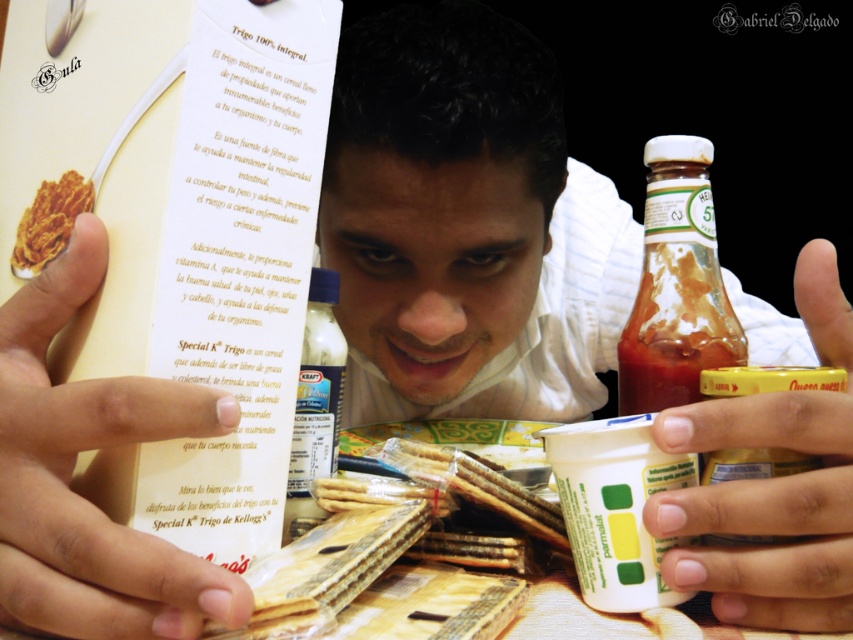
Can you confirm if smooth skin face at center is bigger than yellow matte jar at lower right?

Yes.

The width and height of the screenshot is (853, 640). What do you see at coordinates (466, 225) in the screenshot?
I see `smooth skin face at center` at bounding box center [466, 225].

At what (x,y) coordinates should I click in order to perform the action: click on smooth skin face at center. Please return your answer as a coordinate pair (x, y). Looking at the image, I should click on (466, 225).

Does white matte finger at center have a greater width compared to crispy golden cereal at center?

Indeed, white matte finger at center has a greater width compared to crispy golden cereal at center.

Does white matte finger at center appear under crispy golden cereal at center?

Yes.

Does point (39, 426) lie in front of point (33, 269)?

That is True.

Where is `white matte finger at center`? white matte finger at center is located at coordinates (71, 477).

Does smooth skin face at center have a greater width compared to translucent plastic bottle at center?

Yes.

Can you confirm if smooth skin face at center is smaller than translucent plastic bottle at center?

No, smooth skin face at center is not smaller than translucent plastic bottle at center.

Identify the location of smooth skin face at center. (466, 225).